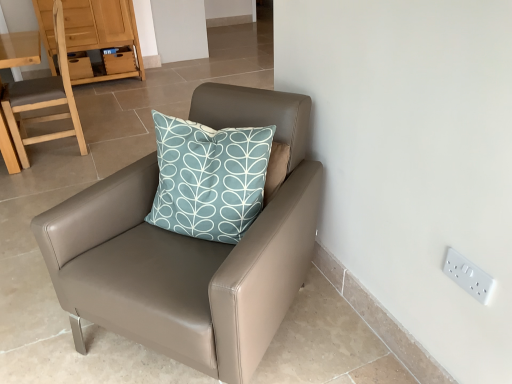
Question: Visually, is white plastic electric outlet at upper right positioned to the left or to the right of light brown wooden chair at left, which is the second chair in front-to-back order?

Choices:
 (A) right
 (B) left

Answer: (A)

Question: In terms of size, does white plastic electric outlet at upper right appear bigger or smaller than light brown wooden chair at left, which is counted as the first chair, starting from the back?

Choices:
 (A) small
 (B) big

Answer: (A)

Question: Which object is the closest to the matte leather chair at center, which is the 2th chair from left to right?

Choices:
 (A) white plastic electric outlet at upper right
 (B) matte wood dresser at upper left
 (C) light brown wooden chair at left, which is the second chair in front-to-back order

Answer: (A)

Question: Which of these objects is positioned closest to the white plastic electric outlet at upper right?

Choices:
 (A) matte wood dresser at upper left
 (B) light brown wooden chair at left, which ranks as the second chair in right-to-left order
 (C) matte leather chair at center, the 1th chair from the front

Answer: (C)